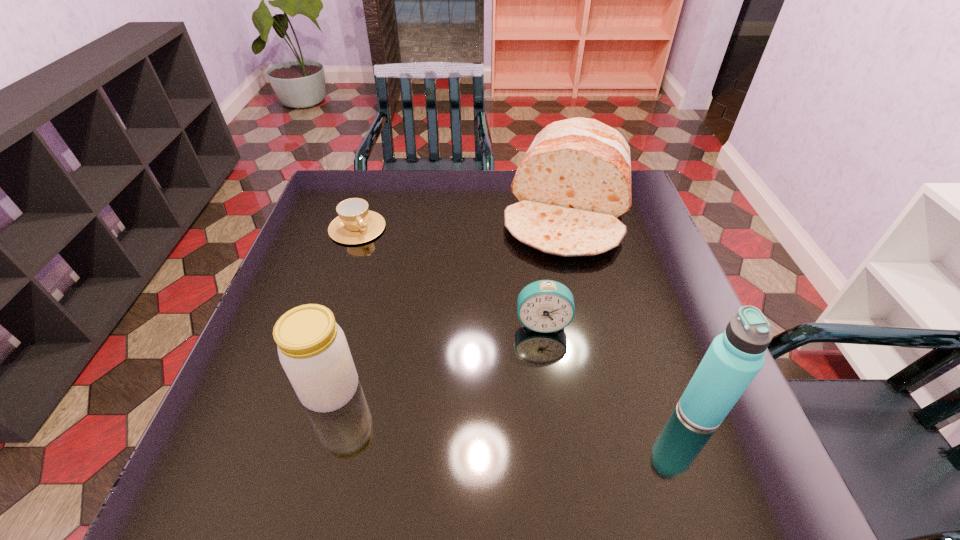
Locate an element on the screen. vacant point at the near edge is located at coordinates (524, 431).

Locate an element on the screen. The height and width of the screenshot is (540, 960). vacant space at the right edge of the desktop is located at coordinates (661, 347).

Where is `free space at the near left corner of the desktop`? free space at the near left corner of the desktop is located at coordinates (308, 409).

You are a GUI agent. You are given a task and a screenshot of the screen. Output one action in this format:
    pyautogui.click(x=<x>, y=<y>)
    Task: Click on the free space between the third farthest object and the jar
    
    Given the screenshot: What is the action you would take?
    pyautogui.click(x=437, y=356)

Identify the location of vacant space that is in between the bread and the thermos bottle. (635, 312).

Where is `vacant region between the jar and the bread`? vacant region between the jar and the bread is located at coordinates (450, 301).

The image size is (960, 540). In order to click on blank region between the jar and the tallest object in this screenshot , I will do `click(516, 401)`.

Locate an element on the screen. vacant area that lies between the jar and the bread is located at coordinates (450, 301).

Where is `free space between the bread and the tallest object`? The image size is (960, 540). free space between the bread and the tallest object is located at coordinates (635, 312).

Find the location of a particular element. This screenshot has height=540, width=960. free space between the bread and the shortest object is located at coordinates (464, 220).